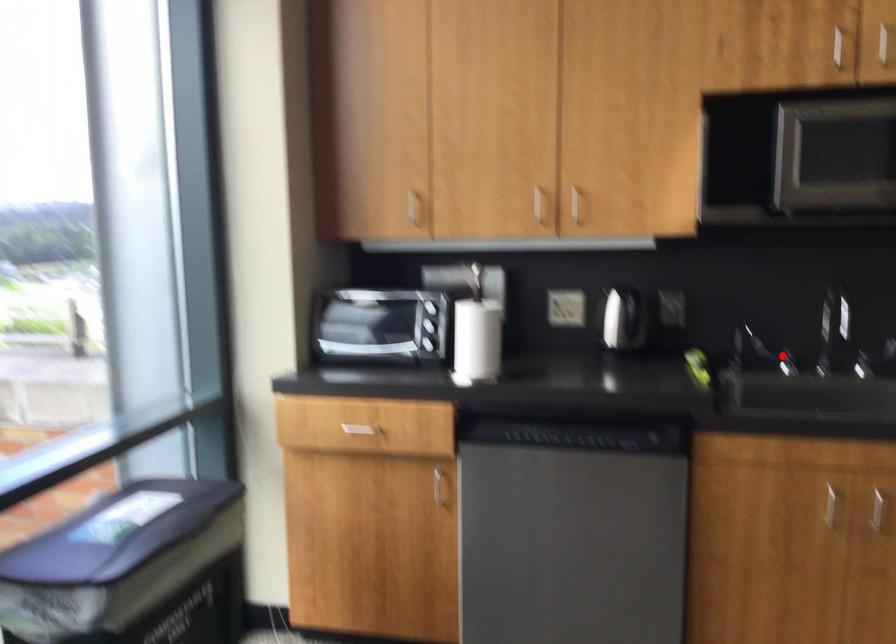
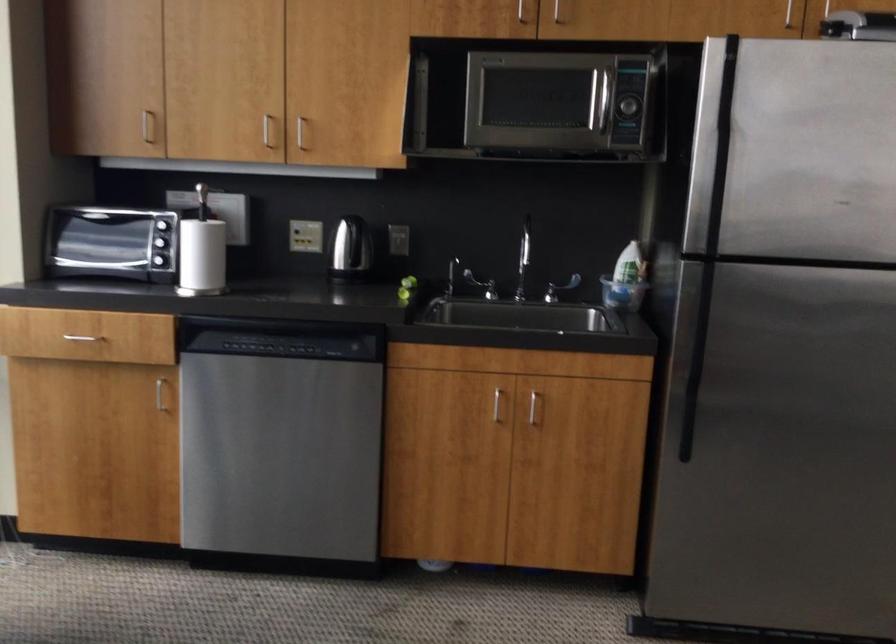
Question: I am providing you with two images of the same scene from different viewpoints. Given a red point in image1, look at the same physical point in image2. Is it:

Choices:
 (A) Closer to the viewpoint
 (B) Farther from the viewpoint

Answer: (B)